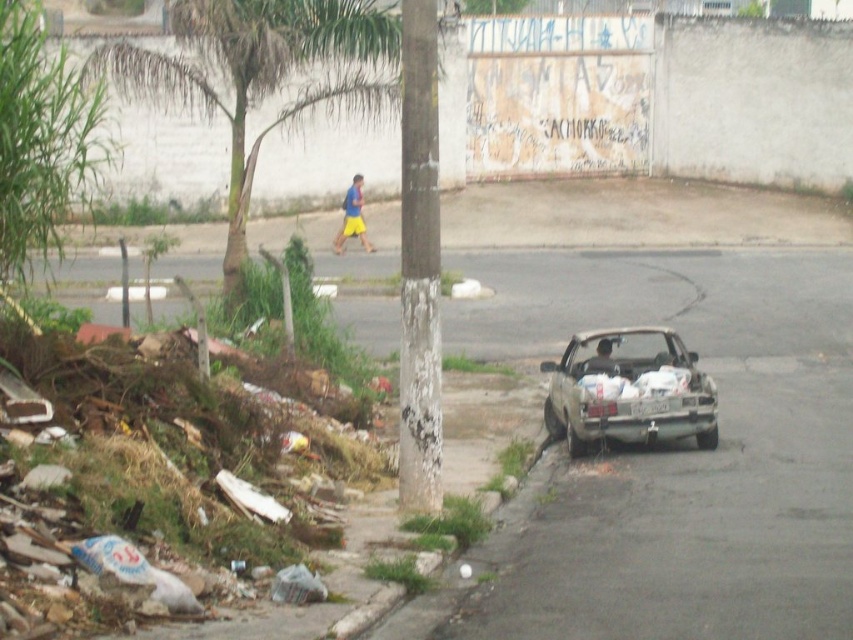
You are standing at the point marked by the coordinate (352, 216), which corresponds to the blue yellow shorts at center. Looking around, you see a tree trunk in the middle of the image and debris along the roadside. Which direction should you walk to reach the tree trunk?

The tree trunk is in the middle of the image, so from the blue yellow shorts at center located at point (352, 216), you should walk towards the center of the image to reach the tree trunk.

You are standing at the point closer to the camera in the image. Which point are you at, point [122,60] or point [601,436]?

You are at point [122,60] because it is further to the camera than point [601,436].